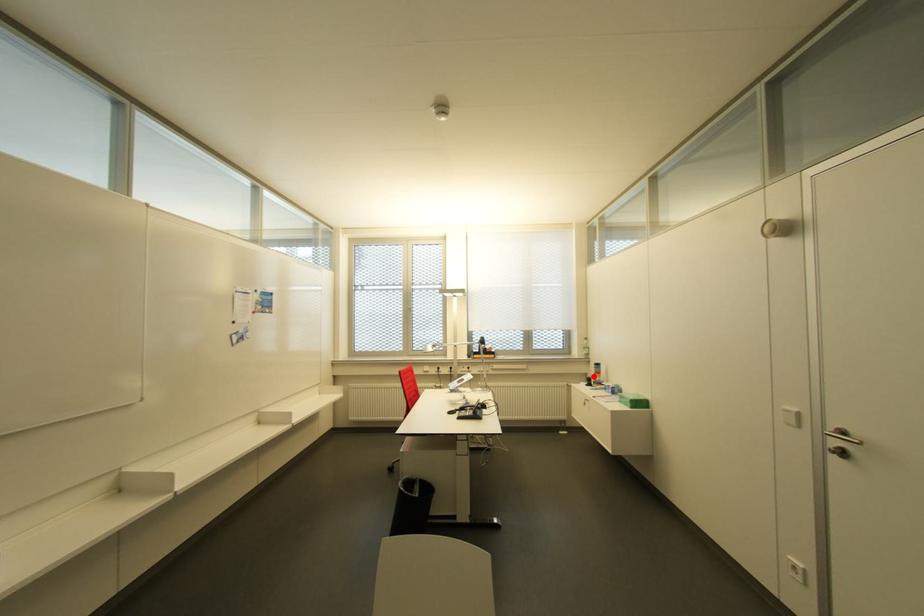
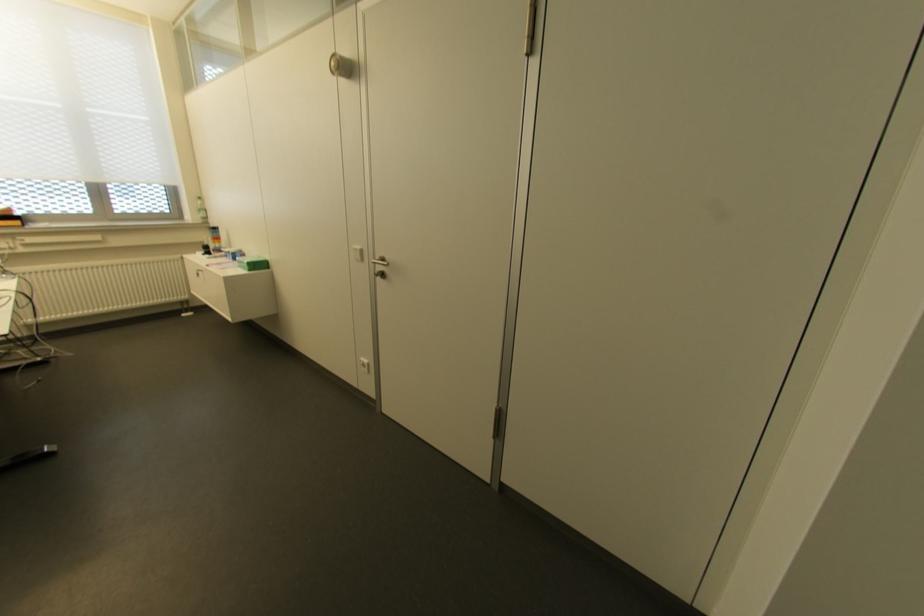
In the second image, find the point that corresponds to the highlighted location in the first image.

(213, 243)